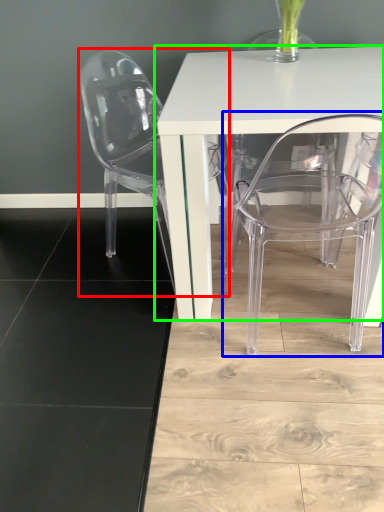
Question: Which object is positioned farthest from chair (highlighted by a red box)? Select from chair (highlighted by a blue box) and table (highlighted by a green box).

Choices:
 (A) chair
 (B) table

Answer: (A)